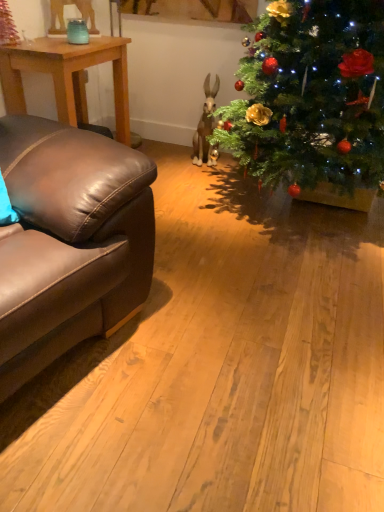
Where is `vacant area that is situated to the right of brown leather couch at left`? This screenshot has width=384, height=512. vacant area that is situated to the right of brown leather couch at left is located at coordinates (218, 334).